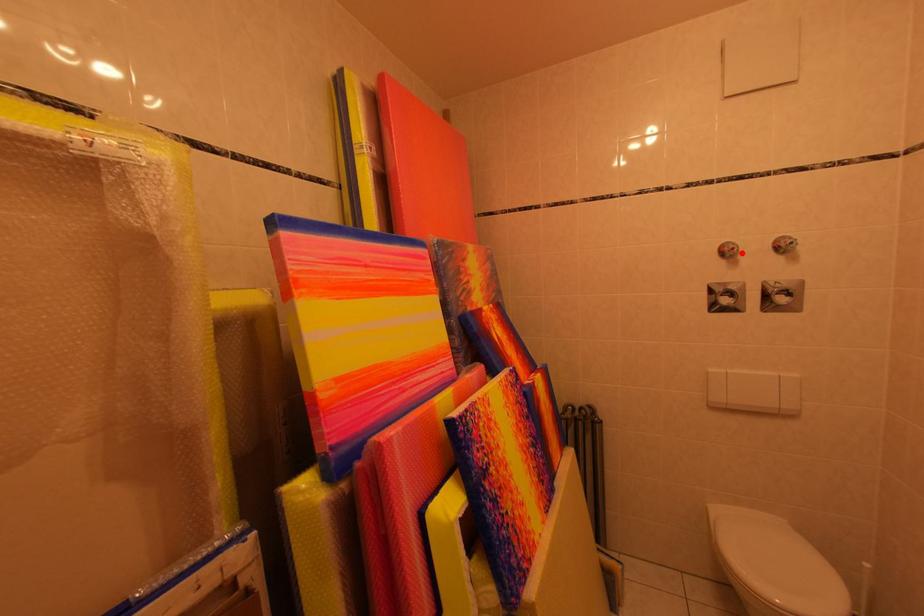
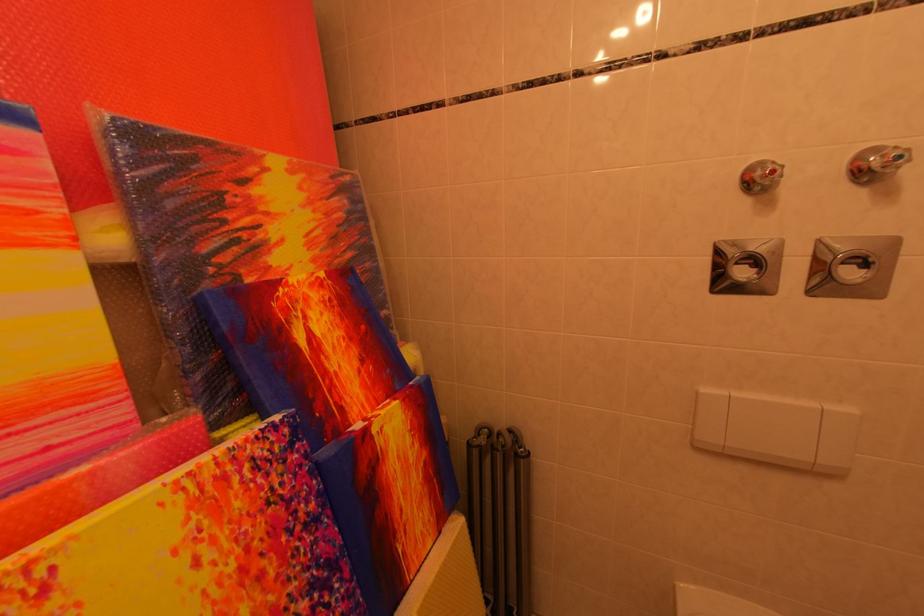
Locate, in the second image, the point that corresponds to the highlighted location in the first image.

(782, 176)